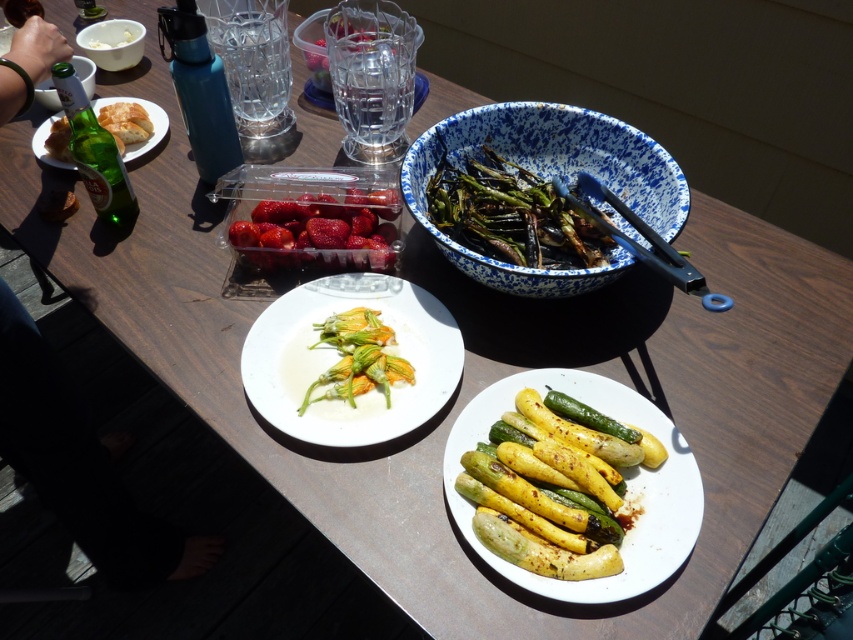
Question: Which point is farther to the camera?

Choices:
 (A) (426, 138)
 (B) (90, 42)

Answer: (B)

Question: Does red glossy strawberries at upper center appear over white matte bowl at upper center?

Choices:
 (A) yes
 (B) no

Answer: (B)

Question: Can you confirm if white matte plate at center is smaller than white matte bowl at upper center?

Choices:
 (A) yes
 (B) no

Answer: (B)

Question: Estimate the real-world distances between objects in this image. Which object is farther from the white matte bowl at upper center?

Choices:
 (A) green glass bottle at upper left
 (B) barefoot skin at lower left
 (C) blue speckled bowl at upper center
 (D) blue speckled bowl at upper right

Answer: (D)

Question: Estimate the real-world distances between objects in this image. Which object is farther from the red glossy strawberries at upper center?

Choices:
 (A) green glass bottle at upper left
 (B) blue speckled bowl at upper center
 (C) barefoot skin at lower left
 (D) green matte zucchini flowers at center

Answer: (B)

Question: In this image, where is white matte plate at center located relative to charcoal grilled asparagus at center?

Choices:
 (A) right
 (B) left

Answer: (B)